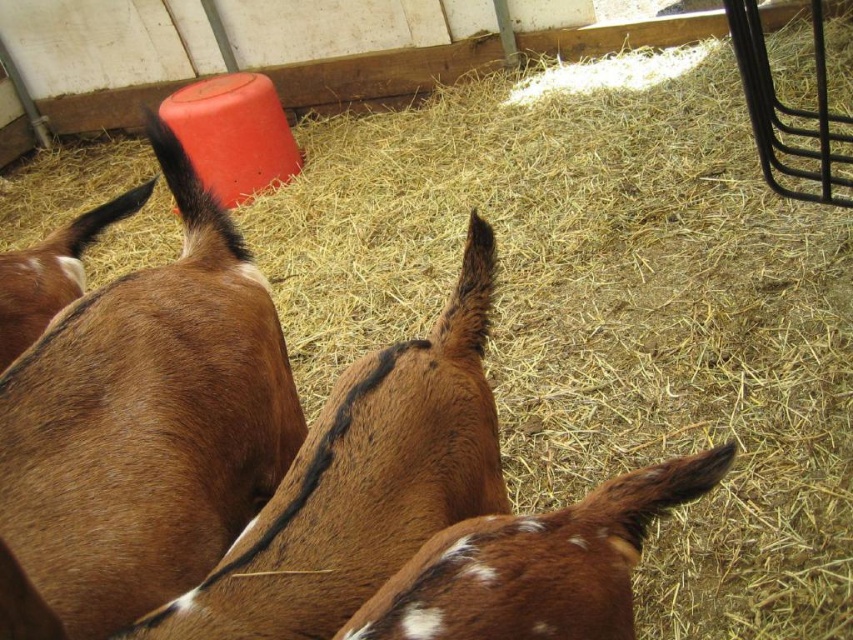
In the scene shown: You are a farmer checking the barn. You see the brown fuzzy goat at upper left and the brown speckled fur at center. Which goat is taller?

The brown fuzzy goat at upper left is taller than the brown speckled fur at center.

You are standing at the entrance of the barn and see a point marked at coordinate (142, 429). Which object does this point lie on?

The point at coordinate (142, 429) lies on the brown fuzzy goat at upper left.